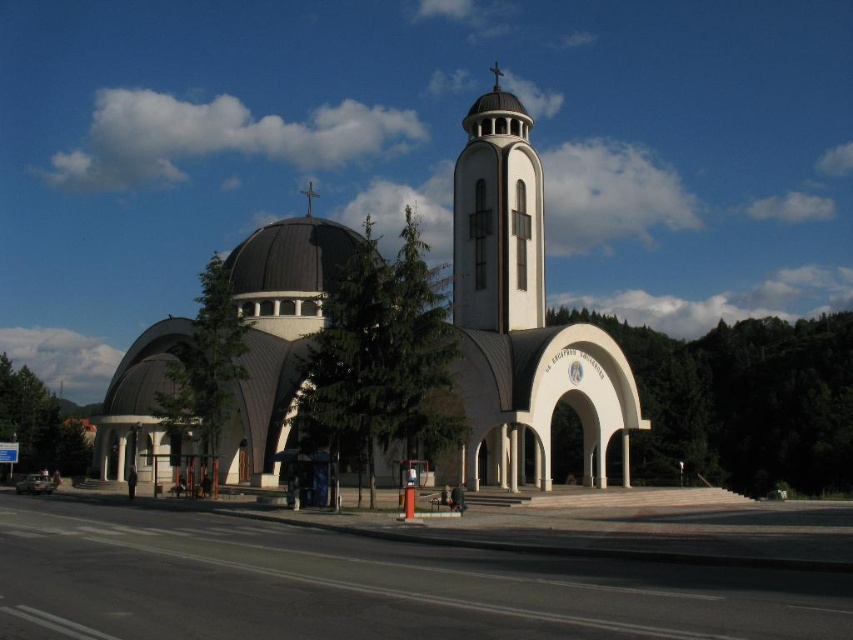
You are an architect designing a new garden layout around the white smooth church at center and the metallic cross at center. If you want to place a small flower bed between them, which object should be closer to the flower bed to ensure it fits within the available space?

The flower bed should be placed closer to the metallic cross at center because the white smooth church at center might be wider than the metallic cross at center, requiring more space between them.

You are an architect evaluating the design of the modern church. You notice the white smooth tower at center and the metallic cross at center. Which object has a smaller width?

The white smooth tower at center is thinner than the metallic cross at center, so the white smooth tower at center has a smaller width.

Where is the white smooth church at center located in the image?

The white smooth church at center is located at point [520,317] in the image.